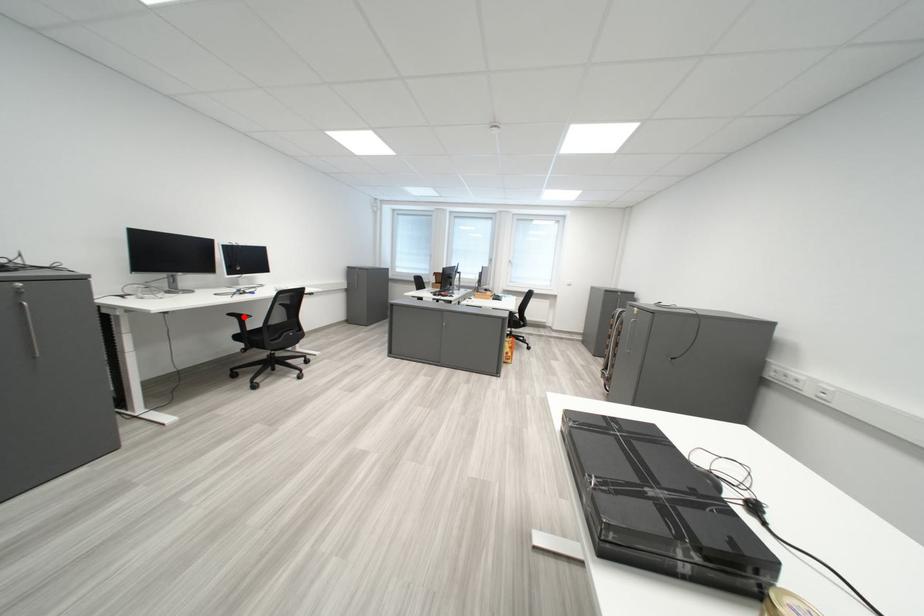
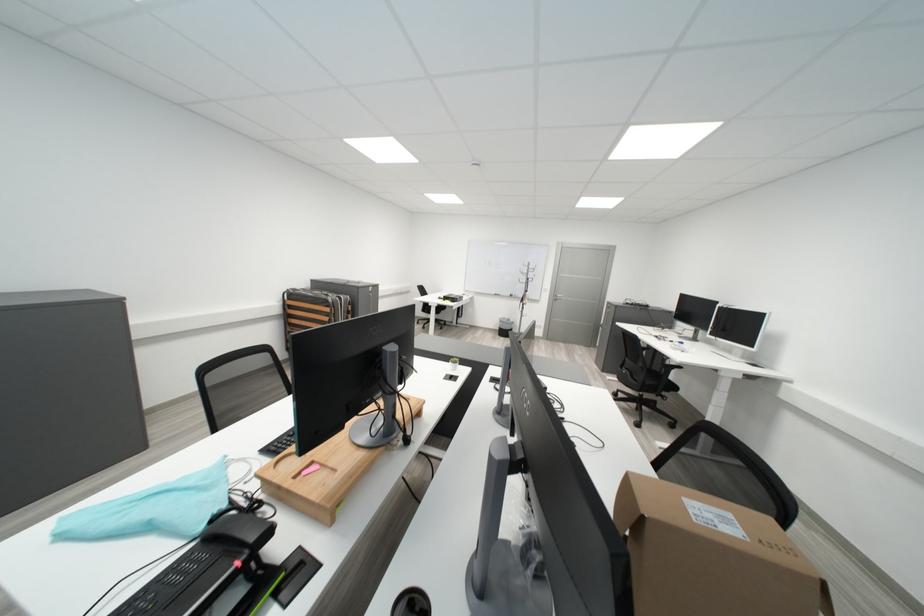
Question: I am providing you with two images of the same scene from different viewpoints. A red point is marked on the first image. Is the red point's position out of view in image 2?

Choices:
 (A) Yes
 (B) No

Answer: (A)